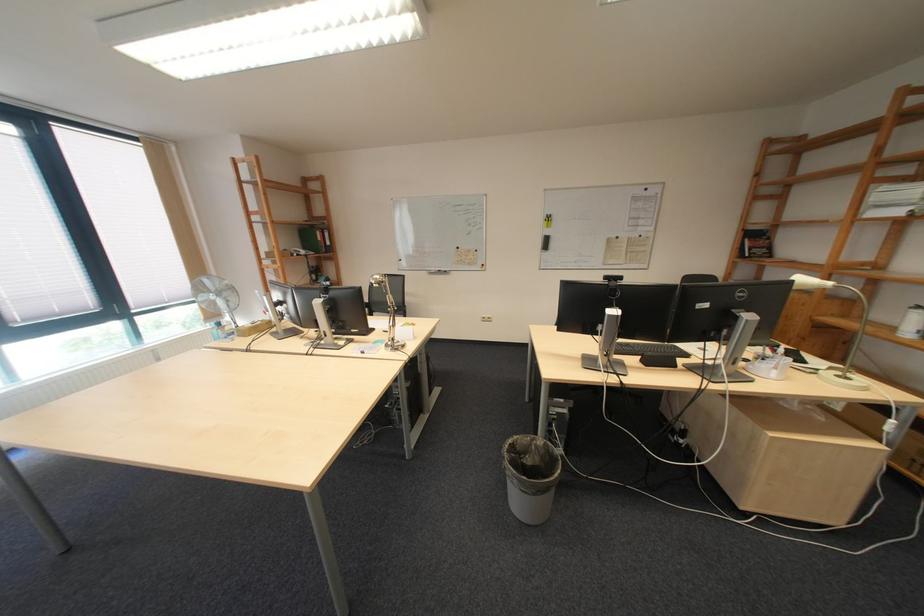
Image resolution: width=924 pixels, height=616 pixels. What do you see at coordinates (769, 365) in the screenshot?
I see `a clear plastic organizer` at bounding box center [769, 365].